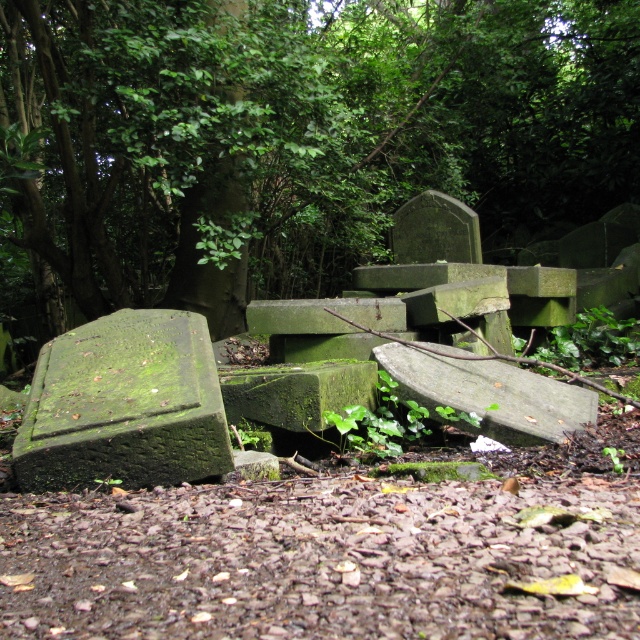
Who is shorter, green mossy tombstone at center or green mossy gravestone at lower left?

green mossy gravestone at lower left is shorter.

Between green mossy tombstone at center and green mossy gravestone at lower left, which one is positioned higher?

Positioned higher is green mossy tombstone at center.

Find the location of a particular element. green mossy tombstone at center is located at coordinates (292, 138).